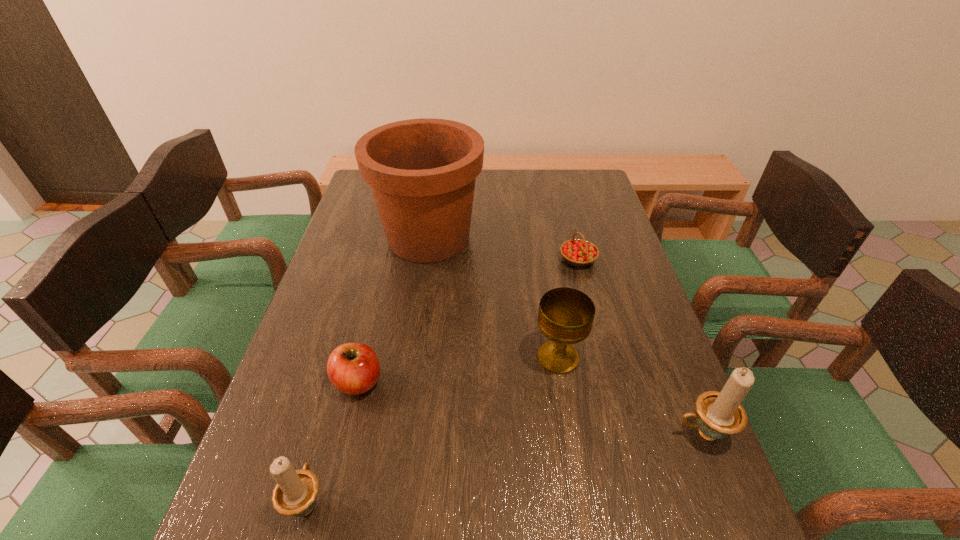
At what (x,y) coordinates should I click in order to perform the action: click on flowerpot that is at the left edge. Please return your answer as a coordinate pair (x, y). The image size is (960, 540). Looking at the image, I should click on (422, 172).

You are a GUI agent. You are given a task and a screenshot of the screen. Output one action in this format:
    pyautogui.click(x=<x>, y=<y>)
    Task: Click on the apple that is at the left edge
    The image size is (960, 540).
    Given the screenshot: What is the action you would take?
    pyautogui.click(x=353, y=368)

The height and width of the screenshot is (540, 960). I want to click on candle_holder positioned at the right edge, so click(719, 414).

Locate an element on the screen. The width and height of the screenshot is (960, 540). strawberry at the right edge is located at coordinates (578, 252).

Locate an element on the screen. The image size is (960, 540). object at the near left corner is located at coordinates click(x=295, y=494).

In order to click on vacant region at the far edge of the desktop in this screenshot , I will do `click(557, 194)`.

At what (x,y) coordinates should I click in order to perform the action: click on vacant space at the near edge of the desktop. Please return your answer as a coordinate pair (x, y). Looking at the image, I should click on (599, 503).

You are a GUI agent. You are given a task and a screenshot of the screen. Output one action in this format:
    pyautogui.click(x=<x>, y=<y>)
    Task: Click on the vacant space at the left edge
    This screenshot has width=960, height=540.
    Given the screenshot: What is the action you would take?
    pyautogui.click(x=301, y=329)

The image size is (960, 540). In the image, there is a desktop. In order to click on blank space at the right edge in this screenshot , I will do `click(618, 389)`.

Find the location of a particular element. Image resolution: width=960 pixels, height=540 pixels. free space at the far right corner is located at coordinates (559, 182).